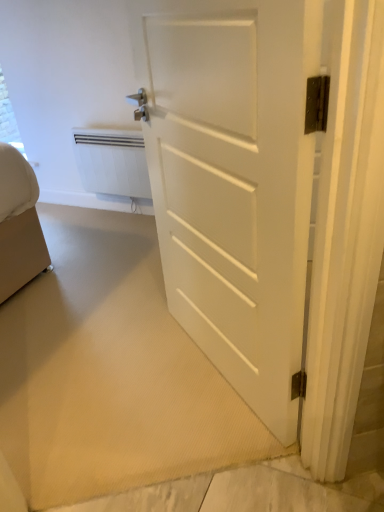
Where is `vacant location below white matte radiator at upper left (from a real-world perspective)`? The height and width of the screenshot is (512, 384). vacant location below white matte radiator at upper left (from a real-world perspective) is located at coordinates (119, 222).